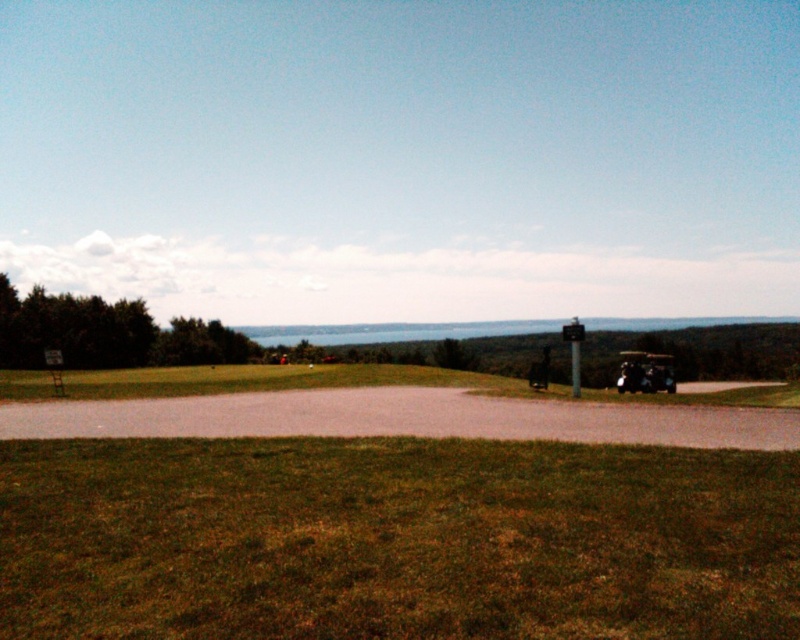
Find the location of a particular element. The width and height of the screenshot is (800, 640). green grass at lower center is located at coordinates (394, 540).

Which of these two, green grass at lower center or metallic green jeep at lower right, stands taller?

metallic green jeep at lower right

Between point (778, 474) and point (644, 381), which one is positioned in front?

Positioned in front is point (778, 474).

Where is `green grass at lower center`? The height and width of the screenshot is (640, 800). green grass at lower center is located at coordinates (394, 540).